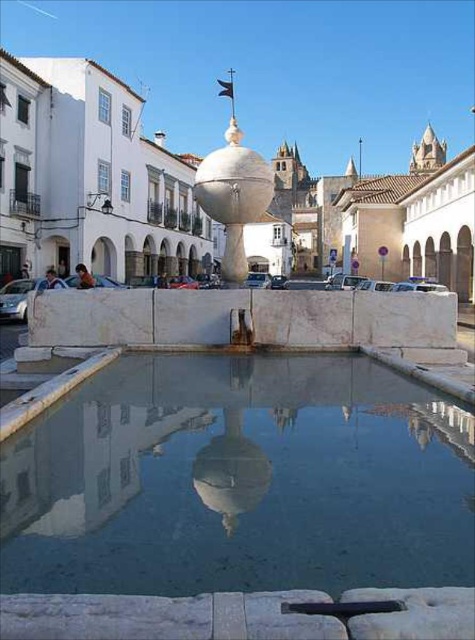
Question: In this image, where is clear glass water at center located relative to white marble sphere at center?

Choices:
 (A) above
 (B) below

Answer: (B)

Question: Is clear glass water at center above white marble sphere at center?

Choices:
 (A) no
 (B) yes

Answer: (A)

Question: Is clear glass water at center in front of white marble sphere at center?

Choices:
 (A) no
 (B) yes

Answer: (B)

Question: Which point is farther from the camera taking this photo?

Choices:
 (A) (247, 161)
 (B) (412, 481)

Answer: (A)